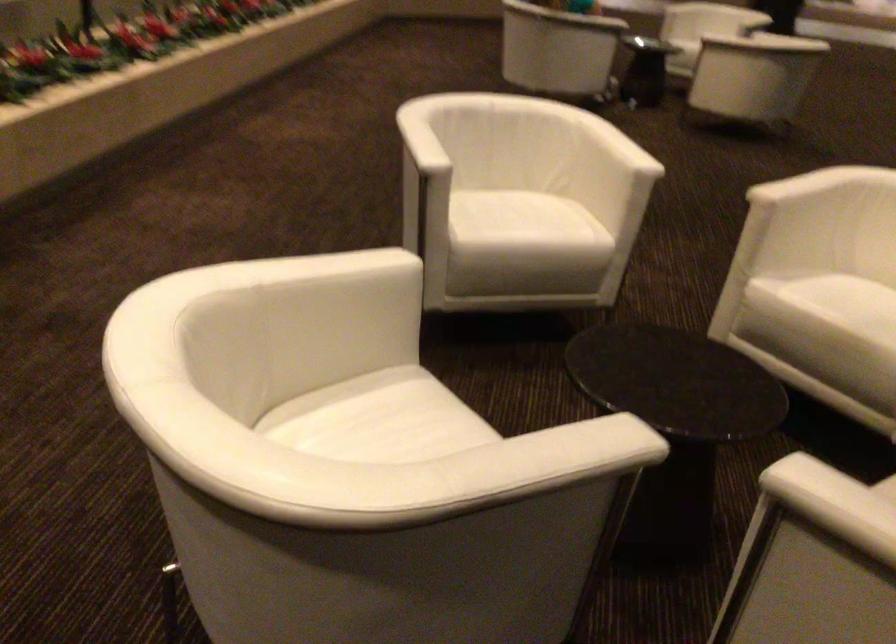
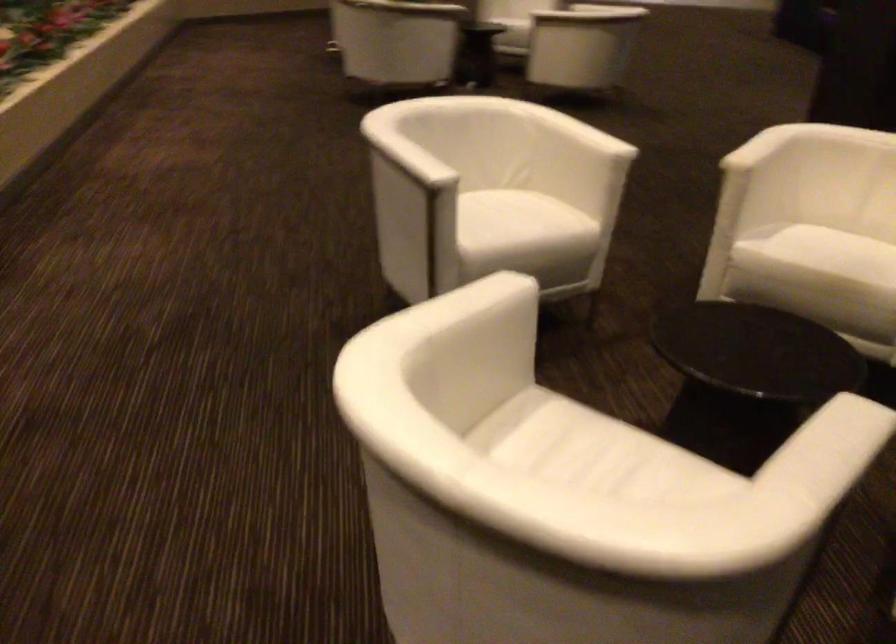
Question: The camera is either moving clockwise (left) or counter-clockwise (right) around the object. The first image is from the beginning of the video and the second image is from the end. Is the camera moving left or right when shooting the video?

Choices:
 (A) Left
 (B) Right

Answer: (A)